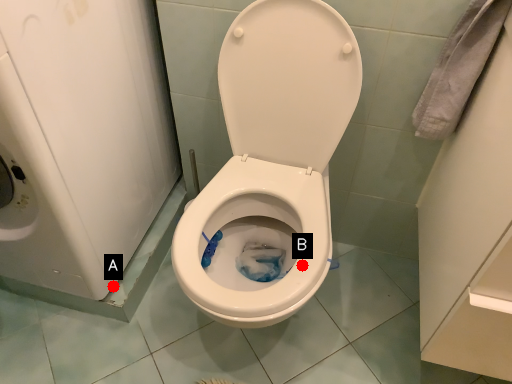
Question: Two points are circled on the image, labeled by A and B beside each circle. Which of the following is the closest to the observer?

Choices:
 (A) A is closer
 (B) B is closer

Answer: (B)